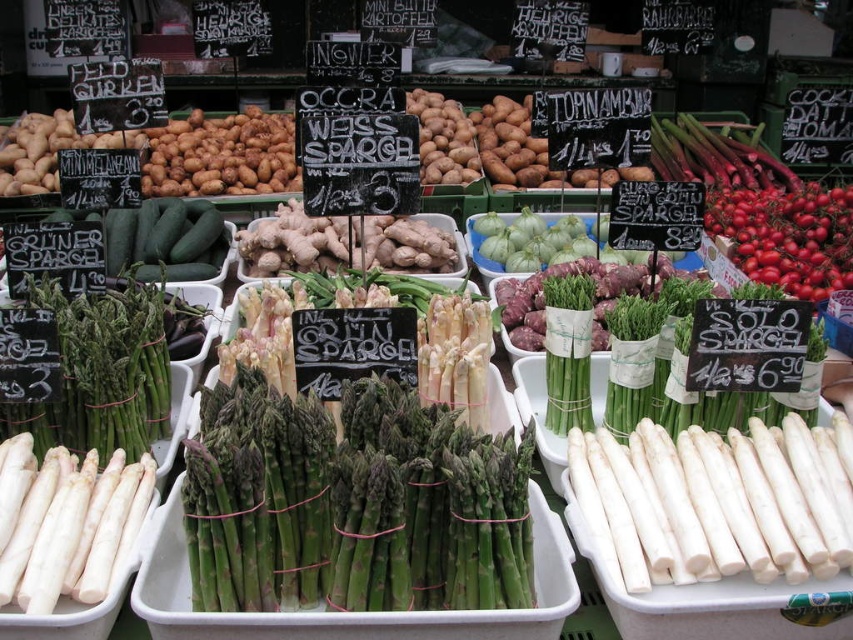
You are a chef preparing a dish that requires precise measurements. You have a container that can hold up to 10 centimeters in width. You need to place either the white smooth asparagus at center or the ripe red tomatoes at upper right into the container. Which vegetable should you choose to ensure it fits?

The ripe red tomatoes at upper right should be chosen because the white smooth asparagus at center has a larger width than the tomatoes, making the tomatoes more likely to fit in the 10 cm container.

You are a vendor at the market and want to rearrange the trays to make more space for new stock. Which object between the white smooth asparagus at center and the ripe red tomatoes at upper right takes up more space and should be moved first?

The ripe red tomatoes at upper right take up more space than the white smooth asparagus at center, so they should be moved first to free up more space.

You are a delivery person who needs to move a box from the point at (799, 556) to the asparagus trays in the foreground. The box is 1.5 meters long. Can you move the box horizontally without tilting it?

The distance between the point at (799, 556) and the asparagus trays in the foreground is 1.20 meters. Since the box is 1.5 meters long, which is longer than the available space, you cannot move the box horizontally without tilting it.